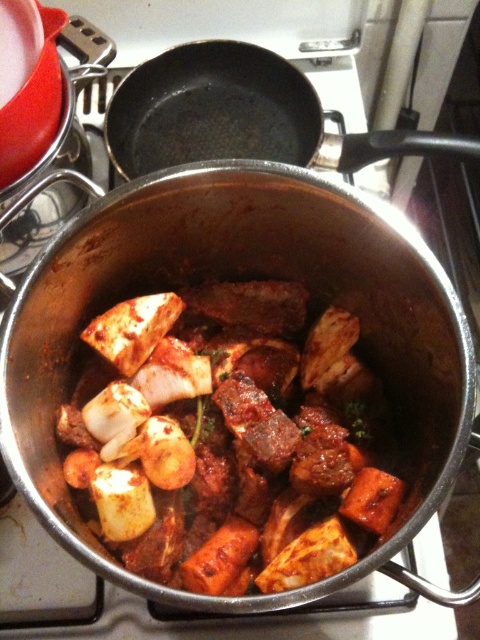
Question: Does spicy brown meat and vegetables at center have a larger size compared to black non-stick frying pan at upper center?

Choices:
 (A) yes
 (B) no

Answer: (A)

Question: Where is spicy brown meat and vegetables at center located in relation to black non-stick frying pan at upper center in the image?

Choices:
 (A) above
 (B) below

Answer: (B)

Question: Can you confirm if spicy brown meat and vegetables at center is positioned below black non-stick frying pan at upper center?

Choices:
 (A) no
 (B) yes

Answer: (B)

Question: Which point is closer to the camera?

Choices:
 (A) spicy brown meat and vegetables at center
 (B) black non-stick frying pan at upper center

Answer: (A)